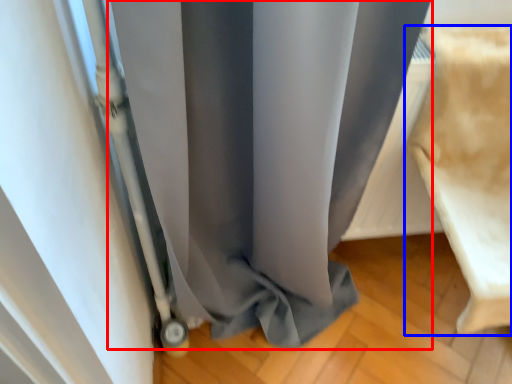
Question: Which object appears closest to the camera in this image, curtain (highlighted by a red box) or furniture (highlighted by a blue box)?

Choices:
 (A) curtain
 (B) furniture

Answer: (A)